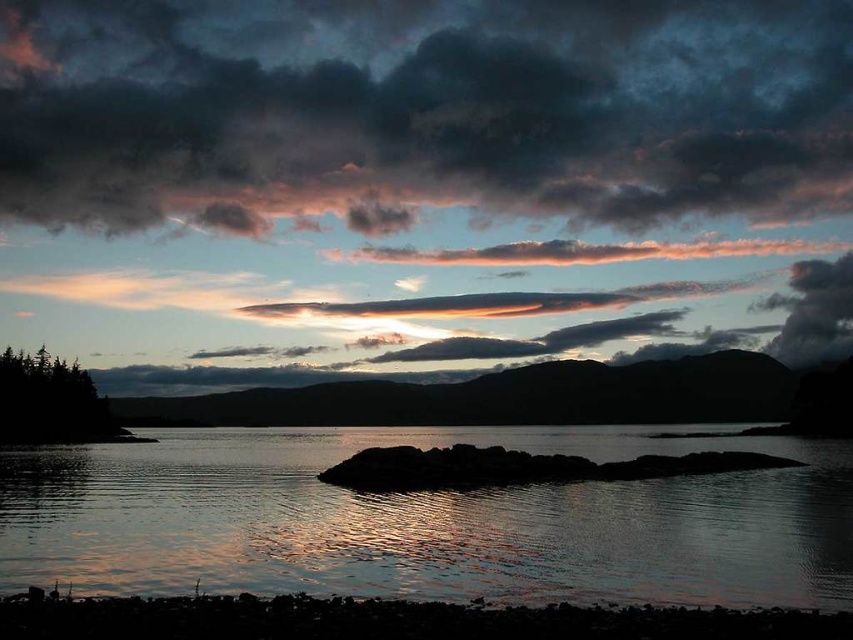
You are an astronomer observing the sky and see the dark gray cloud at upper center and the translucent pink cloud at center. Which cloud is higher in the sky?

The dark gray cloud at upper center is higher in the sky because it is positioned over the translucent pink cloud at center.

You are an astronomer analyzing the image. You need to determine the position of the silvery reflective water at center in the image. What are its coordinates?

The silvery reflective water at center is located at coordinates point [428,518].